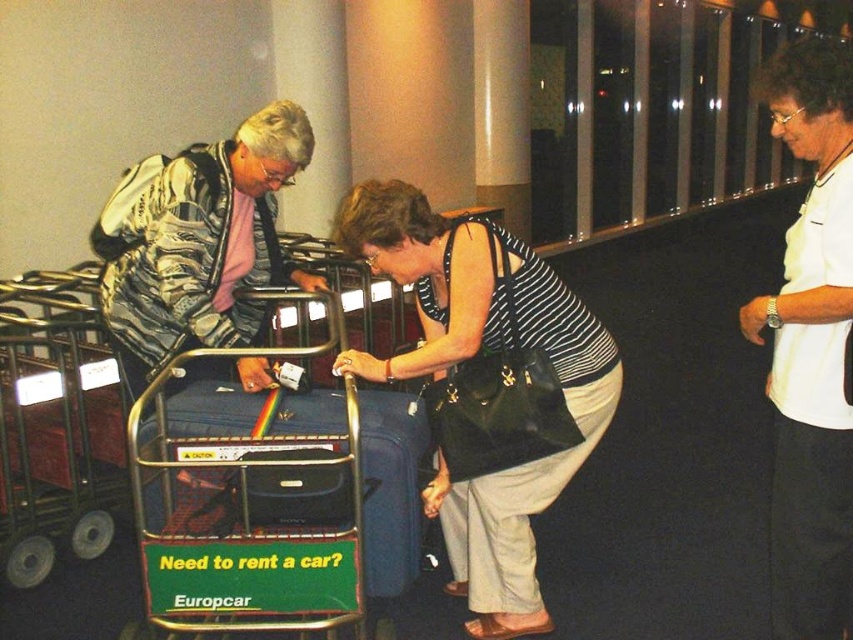
What is located at the point with coordinates (811,348) in the image?

The white smooth shirt at right is located at point (811,348).

You are standing in the airport baggage claim area and see two points marked on the floor. The first point is at coordinate point (828, 435) and the second is at point (252, 204). Which point is closer to your current position?

Point (828, 435) is closer to the camera than point (252, 204), so the first point is closer to your current position.

You are a traveler trying to locate your luggage. You see a white smooth shirt at right and a blue fabric suitcase at center. Which object is positioned higher in the image?

The white smooth shirt at right is located above the blue fabric suitcase at center, so the white smooth shirt at right is higher.